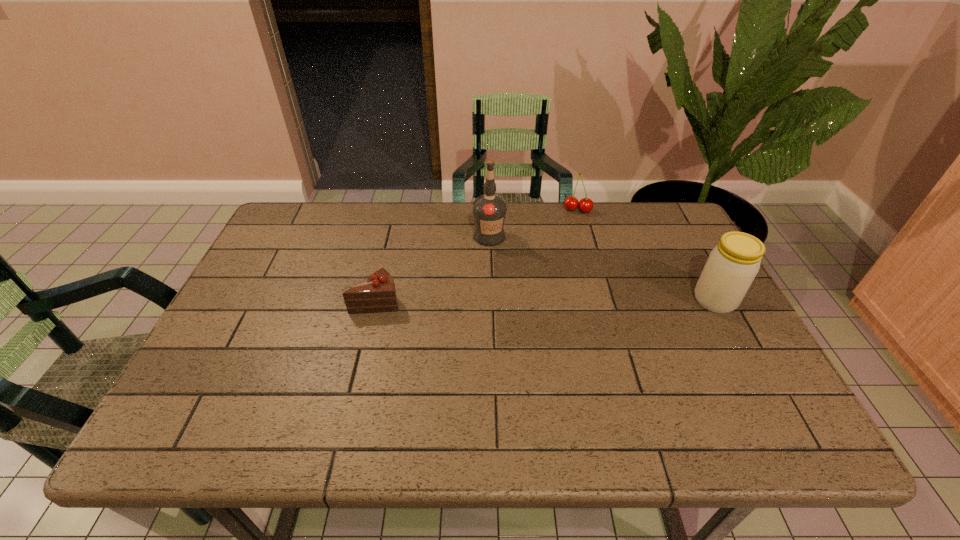
Identify the location of free location at the near edge of the desktop. This screenshot has width=960, height=540. (627, 373).

Locate an element on the screen. vacant space at the left edge is located at coordinates (288, 271).

You are a GUI agent. You are given a task and a screenshot of the screen. Output one action in this format:
    pyautogui.click(x=<x>, y=<y>)
    Task: Click on the vacant point at the right edge
    Image resolution: width=960 pixels, height=540 pixels.
    Given the screenshot: What is the action you would take?
    pyautogui.click(x=740, y=347)

The height and width of the screenshot is (540, 960). I want to click on vacant space at the far left corner, so click(318, 233).

This screenshot has width=960, height=540. I want to click on vacant region at the near left corner of the desktop, so click(202, 373).

The width and height of the screenshot is (960, 540). Identify the location of free space that is in between the second farthest object and the cherry. (534, 223).

Identify the location of vacant point located between the tallest object and the chocolate cake. The image size is (960, 540). (433, 268).

Where is `unoccupied position between the second shortest object and the chocolate cake`? Image resolution: width=960 pixels, height=540 pixels. unoccupied position between the second shortest object and the chocolate cake is located at coordinates (477, 255).

The image size is (960, 540). Find the location of `free point between the jar and the farthest object`. free point between the jar and the farthest object is located at coordinates pos(646,255).

This screenshot has height=540, width=960. Find the location of `free area in between the farthest object and the second farthest object`. free area in between the farthest object and the second farthest object is located at coordinates (534, 223).